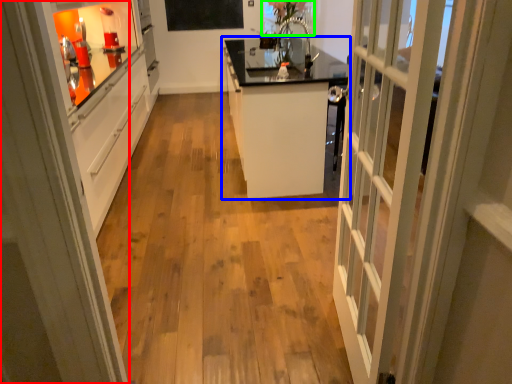
Question: Which is nearer to the door (highlighted by a red box)? cabinetry (highlighted by a blue box) or window screen (highlighted by a green box).

Choices:
 (A) cabinetry
 (B) window screen

Answer: (A)